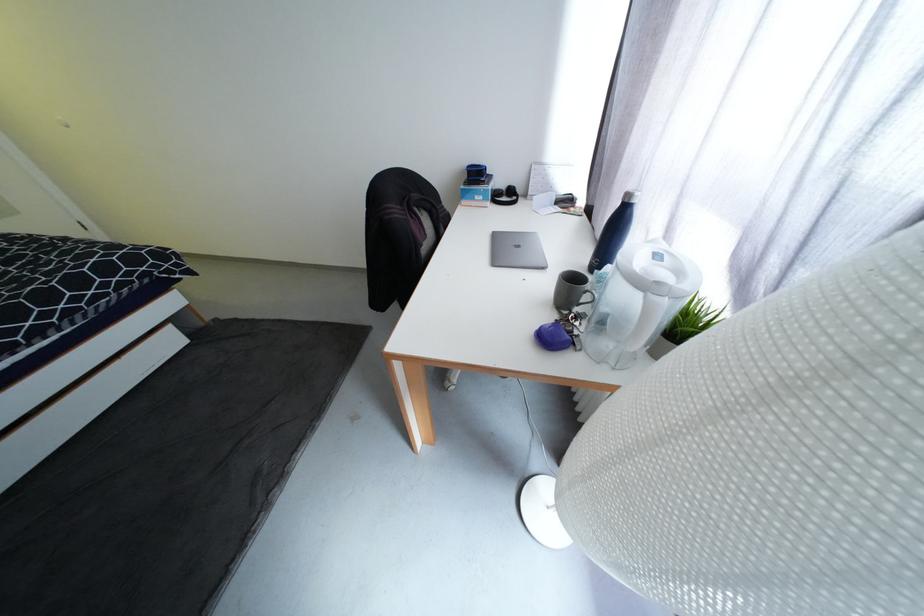
Image resolution: width=924 pixels, height=616 pixels. I want to click on grey mug handle, so click(x=594, y=297).